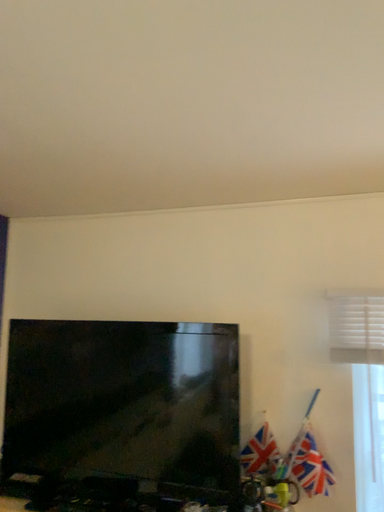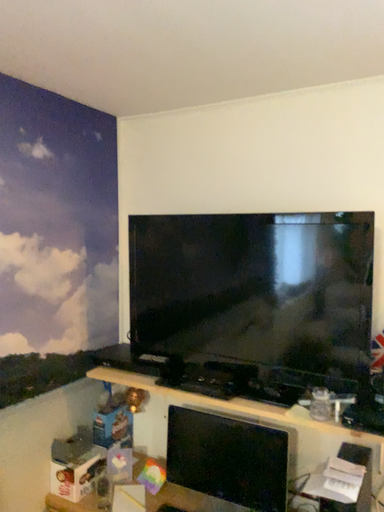
Question: Which way did the camera rotate in the video?

Choices:
 (A) rotated upward
 (B) rotated downward

Answer: (B)